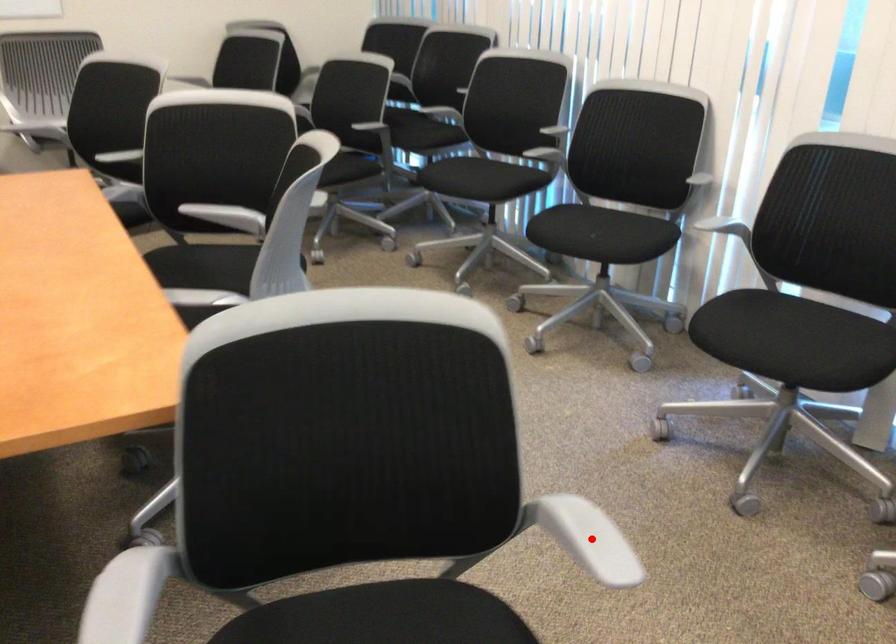
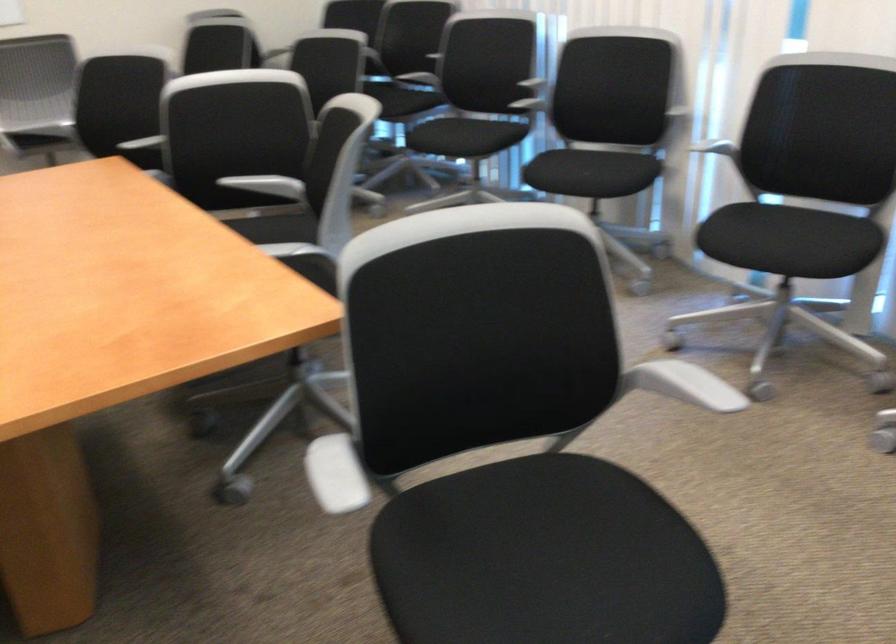
Question: A red point is marked in image1. In image2, is the corresponding 3D point closer to the camera or farther? Reply with the corresponding letter.

Choices:
 (A) The corresponding 3D point is closer.
 (B) The corresponding 3D point is farther.

Answer: (B)